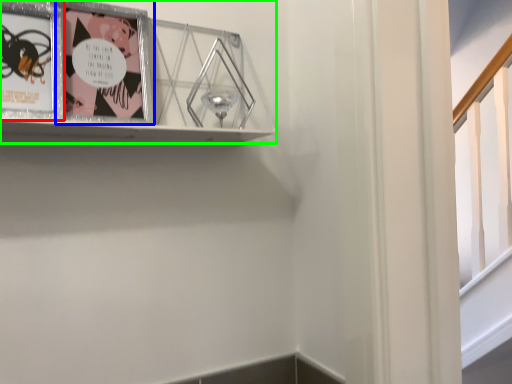
Question: Estimate the real-world distances between objects in this image. Which object is farther from picture frame (highlighted by a red box), picture frame (highlighted by a blue box) or picture frame (highlighted by a green box)?

Choices:
 (A) picture frame
 (B) picture frame

Answer: (B)